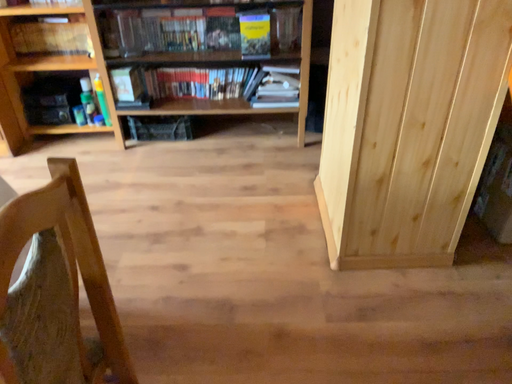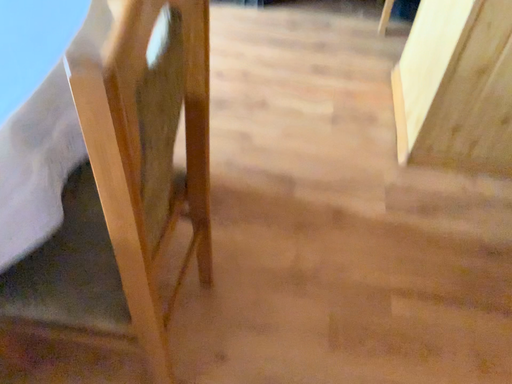
Question: Which way did the camera rotate in the video?

Choices:
 (A) rotated downward
 (B) rotated upward

Answer: (A)